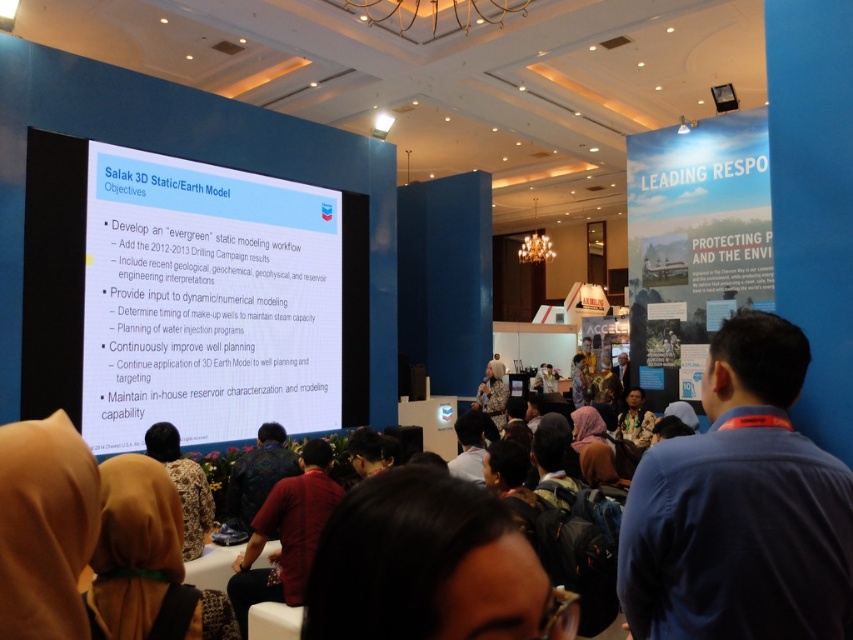
Between dark brown hair at center and dark brown leather jacket at center, which one has more height?

dark brown leather jacket at center

Between point (508, 596) and point (299, 472), which one is positioned in front?

Point (508, 596) is in front.

Is point (467, 586) positioned in front of point (242, 496)?

Yes, it is.

The image size is (853, 640). In order to click on dark brown hair at center in this screenshot , I will do pos(427,566).

Between point (186, 356) and point (334, 544), which one is positioned behind?

The point (186, 356) is more distant.

From the picture: Is white glossy projection screen at upper center to the right of dark brown hair at center from the viewer's perspective?

Incorrect, white glossy projection screen at upper center is not on the right side of dark brown hair at center.

Who is more forward, (x=186, y=272) or (x=367, y=528)?

Point (x=367, y=528) is in front.

The width and height of the screenshot is (853, 640). I want to click on white glossy projection screen at upper center, so click(x=189, y=296).

Which of these two, blue shirt at center or red cotton shirt at center, stands shorter?

With less height is blue shirt at center.

Is point (807, 449) positioned behind point (281, 512)?

No.

Locate an element on the screen. This screenshot has height=640, width=853. blue shirt at center is located at coordinates (740, 508).